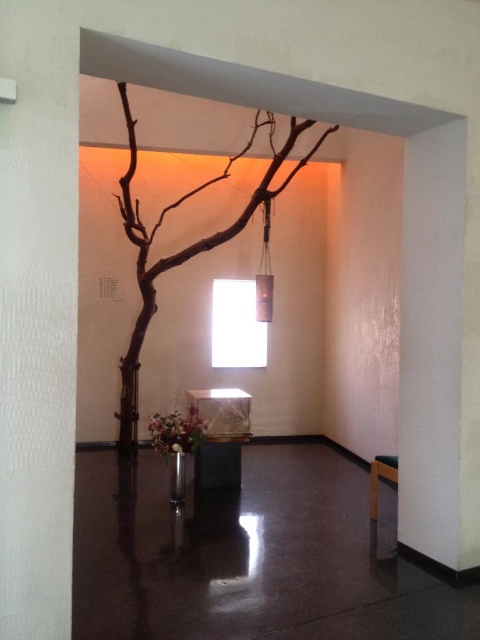
Question: Which point is closer to the camera taking this photo?

Choices:
 (A) (165, 451)
 (B) (372, 474)

Answer: (B)

Question: Is brown matte tree at center to the right of white glossy vase at center from the viewer's perspective?

Choices:
 (A) no
 (B) yes

Answer: (A)

Question: Does brown matte tree at center have a lesser width compared to wooden bench at lower right?

Choices:
 (A) no
 (B) yes

Answer: (A)

Question: Based on their relative distances, which object is farther from the white glossy vase at center?

Choices:
 (A) brown matte tree at center
 (B) wooden bench at lower right

Answer: (A)

Question: Which object is closer to the camera taking this photo?

Choices:
 (A) brown matte tree at center
 (B) wooden bench at lower right
 (C) white glossy vase at center

Answer: (B)

Question: Can you confirm if white glossy vase at center is positioned above wooden bench at lower right?

Choices:
 (A) no
 (B) yes

Answer: (B)